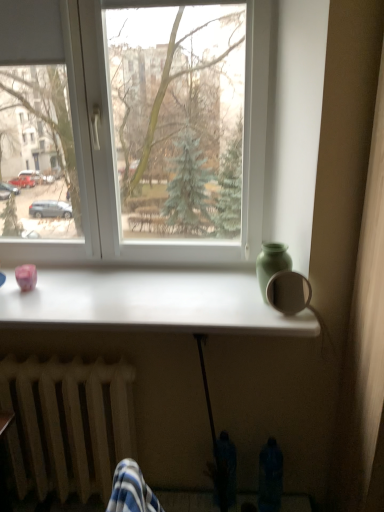
Question: From a real-world perspective, is wooden radiator at lower left on top of white plastic window at center?

Choices:
 (A) yes
 (B) no

Answer: (B)

Question: Does wooden radiator at lower left have a greater height compared to white plastic window at center?

Choices:
 (A) no
 (B) yes

Answer: (A)

Question: Does wooden radiator at lower left have a larger size compared to white plastic window at center?

Choices:
 (A) yes
 (B) no

Answer: (B)

Question: From a real-world perspective, is wooden radiator at lower left positioned under white plastic window at center based on gravity?

Choices:
 (A) yes
 (B) no

Answer: (A)

Question: Is wooden radiator at lower left directly adjacent to white plastic window at center?

Choices:
 (A) no
 (B) yes

Answer: (A)

Question: In terms of size, does green matte vase at upper right appear bigger or smaller than white glossy table at center?

Choices:
 (A) small
 (B) big

Answer: (A)

Question: Considering the relative positions of green matte vase at upper right and white glossy table at center in the image provided, is green matte vase at upper right to the left or to the right of white glossy table at center?

Choices:
 (A) right
 (B) left

Answer: (A)

Question: In terms of height, does green matte vase at upper right look taller or shorter compared to white glossy table at center?

Choices:
 (A) short
 (B) tall

Answer: (B)

Question: Does point (258, 267) appear closer or farther from the camera than point (200, 318)?

Choices:
 (A) farther
 (B) closer

Answer: (A)

Question: Relative to wooden radiator at lower left, is green matte vase at upper right in front or behind?

Choices:
 (A) behind
 (B) front

Answer: (B)

Question: From a real-world perspective, is green matte vase at upper right above or below wooden radiator at lower left?

Choices:
 (A) above
 (B) below

Answer: (A)

Question: From the image's perspective, relative to wooden radiator at lower left, is green matte vase at upper right above or below?

Choices:
 (A) below
 (B) above

Answer: (B)

Question: Considering the relative positions of green matte vase at upper right and wooden radiator at lower left in the image provided, is green matte vase at upper right to the left or to the right of wooden radiator at lower left?

Choices:
 (A) right
 (B) left

Answer: (A)

Question: Considering the positions of white glossy table at center and wooden radiator at lower left in the image, is white glossy table at center wider or thinner than wooden radiator at lower left?

Choices:
 (A) wide
 (B) thin

Answer: (A)

Question: From the image's perspective, is white glossy table at center above or below wooden radiator at lower left?

Choices:
 (A) above
 (B) below

Answer: (A)